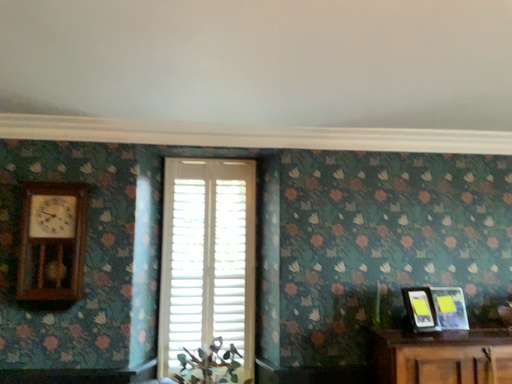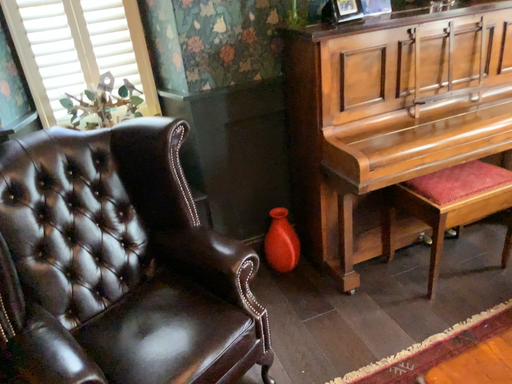
Question: Which way did the camera rotate in the video?

Choices:
 (A) rotated right
 (B) rotated left

Answer: (A)